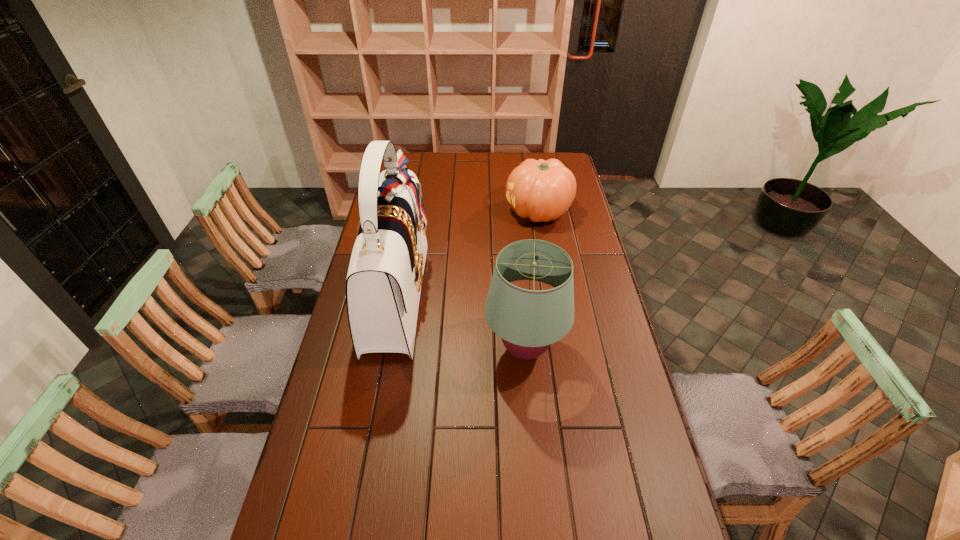
At what (x,y) coordinates should I click in order to perform the action: click on free space between the satchel and the farthest object. Please return your answer as a coordinate pair (x, y). The height and width of the screenshot is (540, 960). Looking at the image, I should click on (468, 253).

Identify the location of free point between the leftmost object and the shortest object. The width and height of the screenshot is (960, 540). (468, 253).

Locate which object ranks second in proximity to the second tallest object. Please provide its 2D coordinates. Your answer should be formatted as a tuple, i.e. [(x, y)], where the tuple contains the x and y coordinates of a point satisfying the conditions above.

[(540, 190)]

What are the coordinates of `object that can be found as the second closest to the tallest object` in the screenshot? It's located at (540, 190).

I want to click on free space in the image that satisfies the following two spatial constraints: 1. on the front-facing side of the tallest object; 2. on the back side of the lampshade, so click(x=387, y=349).

At what (x,y) coordinates should I click in order to perform the action: click on vacant space that satisfies the following two spatial constraints: 1. on the carved face of the pumpkin; 2. on the front side of the lampshade. Please return your answer as a coordinate pair (x, y). The image size is (960, 540). Looking at the image, I should click on (561, 349).

Where is `free location that satisfies the following two spatial constraints: 1. on the carved face of the pumpkin; 2. on the front side of the lampshade`? free location that satisfies the following two spatial constraints: 1. on the carved face of the pumpkin; 2. on the front side of the lampshade is located at coordinates (561, 349).